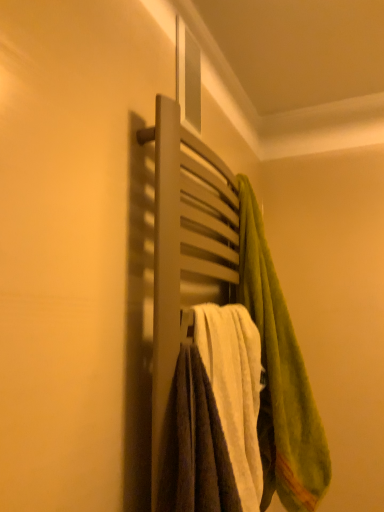
Question: Is white soft towel at center, marked as the first towel in a left-to-right arrangement, in front of or behind green fuzzy towel at upper right, acting as the second towel starting from the left, in the image?

Choices:
 (A) front
 (B) behind

Answer: (A)

Question: From the image's perspective, is white soft towel at center, marked as the first towel in a left-to-right arrangement, located above or below green fuzzy towel at upper right, acting as the second towel starting from the left?

Choices:
 (A) above
 (B) below

Answer: (B)

Question: Which is farther from the green fuzzy towel at upper right, acting as the second towel starting from the left?

Choices:
 (A) white soft towel at center, acting as the 2th towel starting from the right
 (B) matte wooden towel rack at center

Answer: (B)

Question: Estimate the real-world distances between objects in this image. Which object is farther from the green fuzzy towel at upper right, acting as the 1th towel starting from the right?

Choices:
 (A) white soft towel at center, marked as the first towel in a left-to-right arrangement
 (B) matte wooden towel rack at center

Answer: (B)